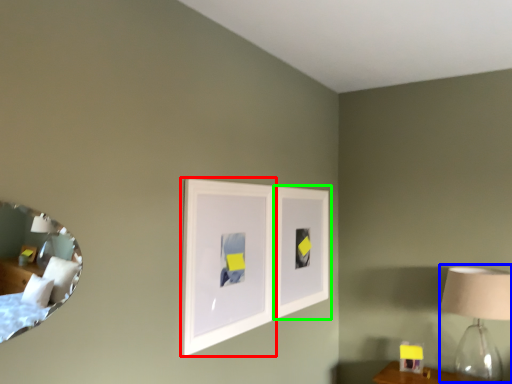
Question: Which object is positioned farthest from picture frame (highlighted by a red box)? Select from table lamp (highlighted by a blue box) and picture frame (highlighted by a green box).

Choices:
 (A) table lamp
 (B) picture frame

Answer: (A)